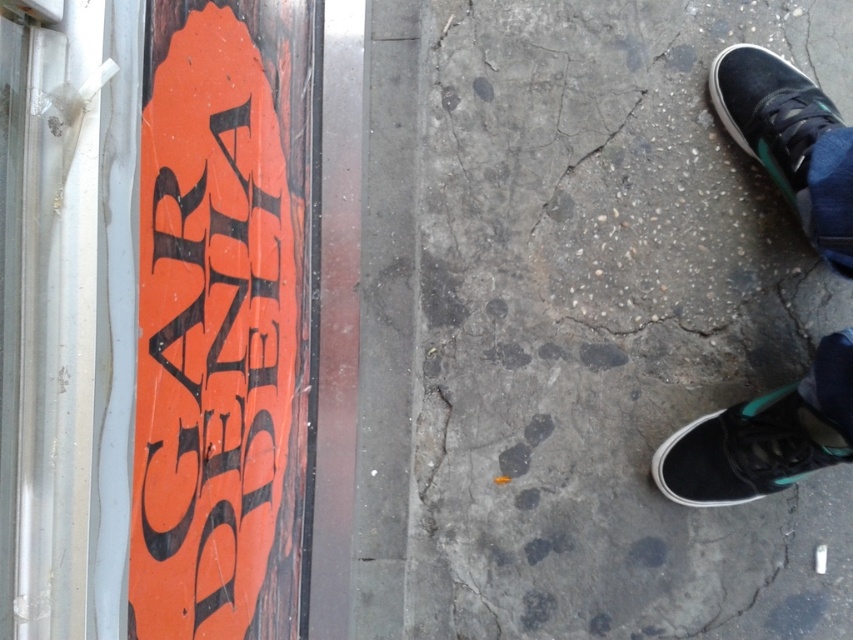
Is gray concrete pavement at center smaller than black canvas shoes at lower right?

No, gray concrete pavement at center is not smaller than black canvas shoes at lower right.

Who is positioned more to the left, gray concrete pavement at center or black canvas shoes at lower right?

gray concrete pavement at center

You are a GUI agent. You are given a task and a screenshot of the screen. Output one action in this format:
    pyautogui.click(x=<x>, y=<y>)
    Task: Click on the gray concrete pavement at center
    This screenshot has height=640, width=853.
    Given the screenshot: What is the action you would take?
    pyautogui.click(x=608, y=324)

Locate an element on the screen. Image resolution: width=853 pixels, height=640 pixels. gray concrete pavement at center is located at coordinates (608, 324).

Is point (733, 452) positioned in front of point (701, 440)?

That is True.

Describe the element at coordinates (763, 436) in the screenshot. The image size is (853, 640). I see `black canvas shoes at lower right` at that location.

You are a GUI agent. You are given a task and a screenshot of the screen. Output one action in this format:
    pyautogui.click(x=<x>, y=<y>)
    Task: Click on the black canvas shoes at lower right
    Image resolution: width=853 pixels, height=640 pixels.
    Given the screenshot: What is the action you would take?
    pyautogui.click(x=763, y=436)

Can you confirm if gray concrete pavement at center is taller than black canvas shoe at lower right?

Correct, gray concrete pavement at center is much taller as black canvas shoe at lower right.

Is gray concrete pavement at center bigger than black canvas shoe at lower right?

Yes, gray concrete pavement at center is bigger than black canvas shoe at lower right.

Is point (611, 616) farther from viewer compared to point (807, 422)?

Yes, it is behind point (807, 422).

The image size is (853, 640). Identify the location of gray concrete pavement at center. (608, 324).